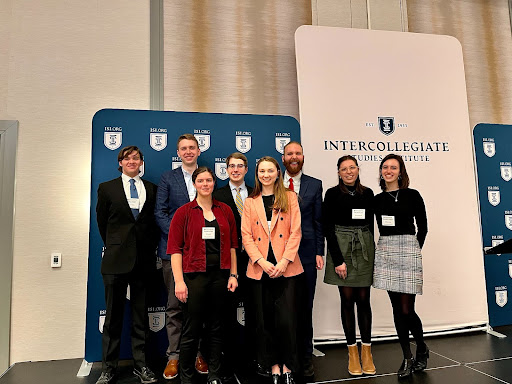
Where is `white box on wall to the left`? Image resolution: width=512 pixels, height=384 pixels. white box on wall to the left is located at coordinates (54, 259).